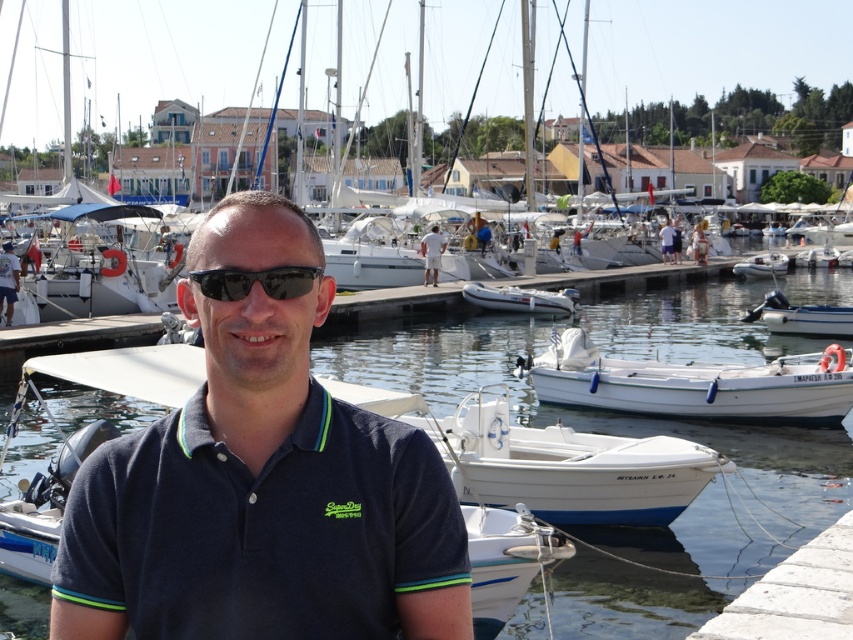
Is white rubber dinghy at center positioned behind white matte dinghy at center?

No, white rubber dinghy at center is closer to the viewer.

Is white rubber dinghy at center bigger than white matte dinghy at center?

Actually, white rubber dinghy at center might be smaller than white matte dinghy at center.

Locate an element on the screen. The image size is (853, 640). white rubber dinghy at center is located at coordinates (521, 298).

Does point (790, 289) come closer to viewer compared to point (786, 324)?

No, (790, 289) is behind (786, 324).

Does clear water at center have a greater width compared to white matte boat at lower right?

Yes, clear water at center is wider than white matte boat at lower right.

Who is more forward, (32,632) or (833,326)?

Point (32,632) is in front.

The height and width of the screenshot is (640, 853). What are the coordinates of `clear water at center` in the screenshot? It's located at (622, 435).

Which is above, navy blue cotton polo shirt at center or white matte boat at lower center?

A: navy blue cotton polo shirt at center is above.

Who is positioned more to the right, navy blue cotton polo shirt at center or white matte boat at lower center?

From the viewer's perspective, white matte boat at lower center appears more on the right side.

Find the location of a particular element. The width and height of the screenshot is (853, 640). navy blue cotton polo shirt at center is located at coordinates (264, 529).